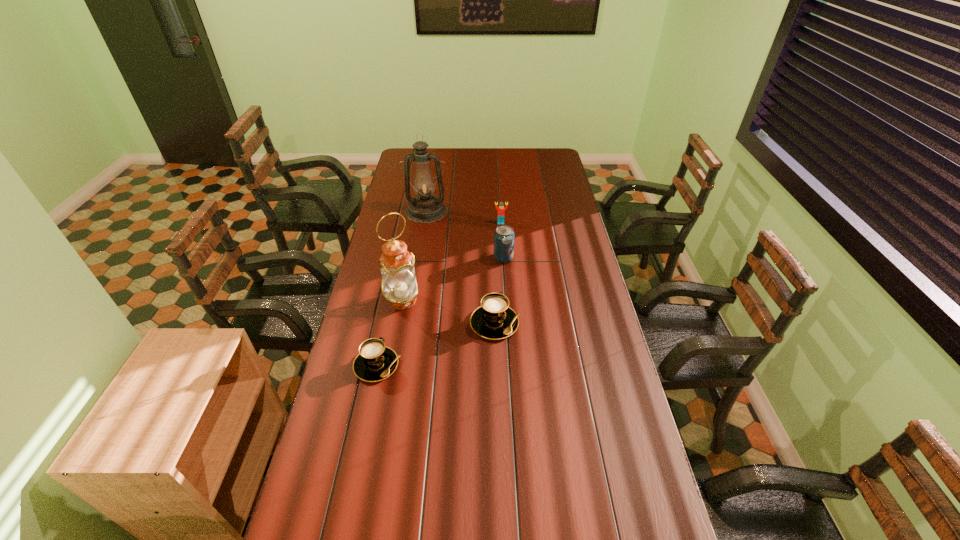
Image resolution: width=960 pixels, height=540 pixels. I want to click on vacant point located between the pop soda and the nearest object, so [x=440, y=312].

Locate an element on the screen. This screenshot has height=540, width=960. object that stands as the closest to the third tallest object is located at coordinates (501, 210).

You are a GUI agent. You are given a task and a screenshot of the screen. Output one action in this format:
    pyautogui.click(x=<x>, y=<y>)
    Task: Click on the fourth closest object relative to the Lego
    This screenshot has width=960, height=540.
    Given the screenshot: What is the action you would take?
    pyautogui.click(x=494, y=319)

The height and width of the screenshot is (540, 960). Find the location of `vacant space that satisfies the following two spatial constraints: 1. on the front side of the farther oil lamp; 2. on the right side of the third tallest object`. vacant space that satisfies the following two spatial constraints: 1. on the front side of the farther oil lamp; 2. on the right side of the third tallest object is located at coordinates (419, 258).

The image size is (960, 540). Find the location of `vacant region that satisfies the following two spatial constraints: 1. on the face of the Lego; 2. on the left side of the third farthest object`. vacant region that satisfies the following two spatial constraints: 1. on the face of the Lego; 2. on the left side of the third farthest object is located at coordinates (503, 258).

You are a GUI agent. You are given a task and a screenshot of the screen. Output one action in this format:
    pyautogui.click(x=<x>, y=<y>)
    Task: Click on the vacant region that satisfies the following two spatial constraints: 1. on the face of the Lego; 2. on the left side of the third farthest object
    
    Given the screenshot: What is the action you would take?
    pyautogui.click(x=503, y=258)